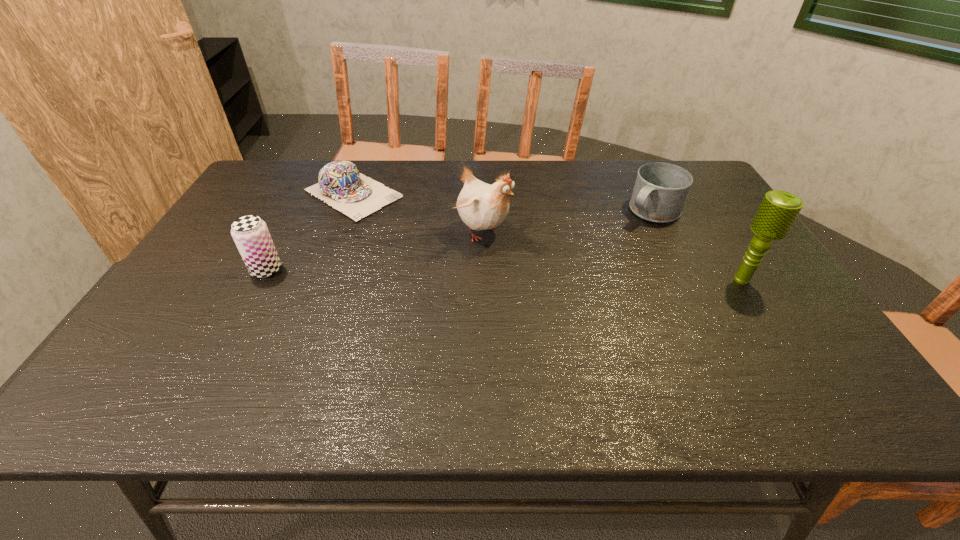
What are the coordinates of `vacant space in between the fourth tallest object and the rightmost object` in the screenshot? It's located at (697, 246).

Where is `unoccupied area between the cap and the microphone`? The image size is (960, 540). unoccupied area between the cap and the microphone is located at coordinates (547, 237).

Identify the location of free space between the rightmost object and the cap. This screenshot has height=540, width=960. (547, 237).

This screenshot has width=960, height=540. In order to click on vacant area that lies between the beer can and the second shortest object in this screenshot , I will do `click(459, 241)`.

I want to click on free spot between the microphone and the third shortest object, so click(504, 275).

Identify the location of vacant space that's between the shortest object and the third object from left to right. (417, 212).

At what (x,y) coordinates should I click in order to perform the action: click on vacant area that lies between the bird and the cap. Please return your answer as a coordinate pair (x, y). Looking at the image, I should click on (417, 212).

Select which object is the closest to the microphone. Please provide its 2D coordinates. Your answer should be formatted as a tuple, i.e. [(x, y)], where the tuple contains the x and y coordinates of a point satisfying the conditions above.

[(660, 191)]

Where is `object that stands as the second closest to the second shortest object`? object that stands as the second closest to the second shortest object is located at coordinates (481, 206).

Identify the location of free space that satisfies the following two spatial constraints: 1. on the back side of the third object from left to right; 2. on the left side of the second shortest object. (480, 212).